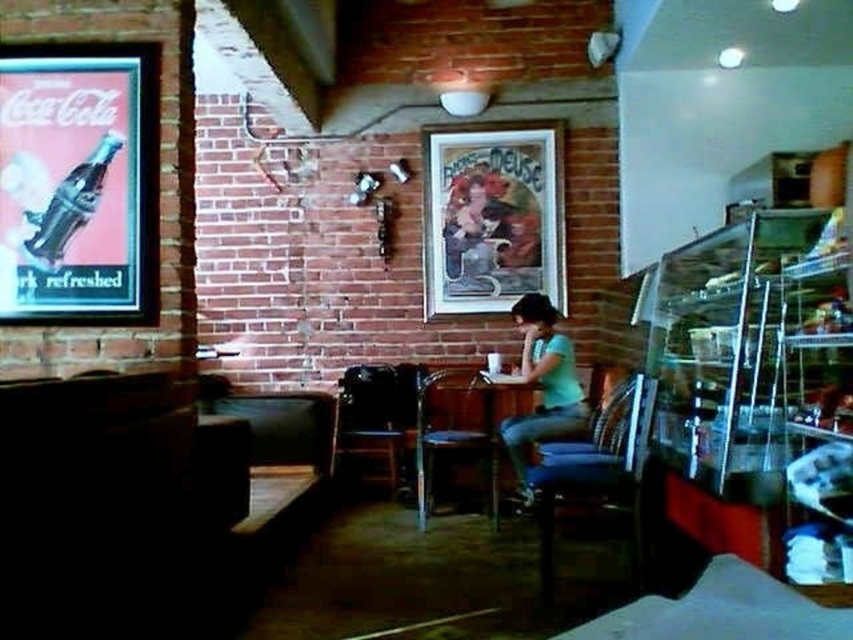
Question: Which object is the farthest from the matte black cat at center?

Choices:
 (A) metallic dark blue chair at center
 (B) matte black chair at center

Answer: (B)

Question: Observing the image, what is the correct spatial positioning of matte black chair at center in reference to metallic dark chair at center?

Choices:
 (A) below
 (B) above

Answer: (B)

Question: Which is nearer to the matte black cat at center?

Choices:
 (A) green matte shirt at center
 (B) wooden table at center

Answer: (A)

Question: Can you confirm if green matte shirt at center is wider than wooden table at center?

Choices:
 (A) yes
 (B) no

Answer: (B)

Question: Which point is farther to the camera?

Choices:
 (A) (386, 449)
 (B) (424, 524)
 (C) (569, 385)

Answer: (A)

Question: In this image, where is green matte shirt at center located relative to metallic dark blue chair at center?

Choices:
 (A) below
 (B) above

Answer: (B)